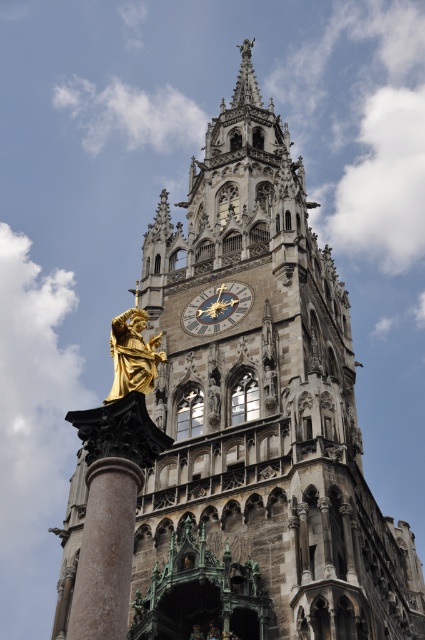
Question: Which object is closer to the camera taking this photo?

Choices:
 (A) gold polished statue at center
 (B) goldmetallicclock at center

Answer: (A)

Question: Is the position of polished marble column at center less distant than that of gold polished statue at center?

Choices:
 (A) yes
 (B) no

Answer: (A)

Question: Which object is positioned closest to the goldmetallicclock at center?

Choices:
 (A) polished marble column at center
 (B) gold polished statue at center

Answer: (B)

Question: Does polished marble column at center have a greater width compared to gold polished statue at center?

Choices:
 (A) no
 (B) yes

Answer: (A)

Question: Estimate the real-world distances between objects in this image. Which object is farther from the gold polished statue at center?

Choices:
 (A) goldmetallicclock at center
 (B) polished marble column at center

Answer: (A)

Question: Does polished marble column at center come in front of gold polished statue at center?

Choices:
 (A) no
 (B) yes

Answer: (B)